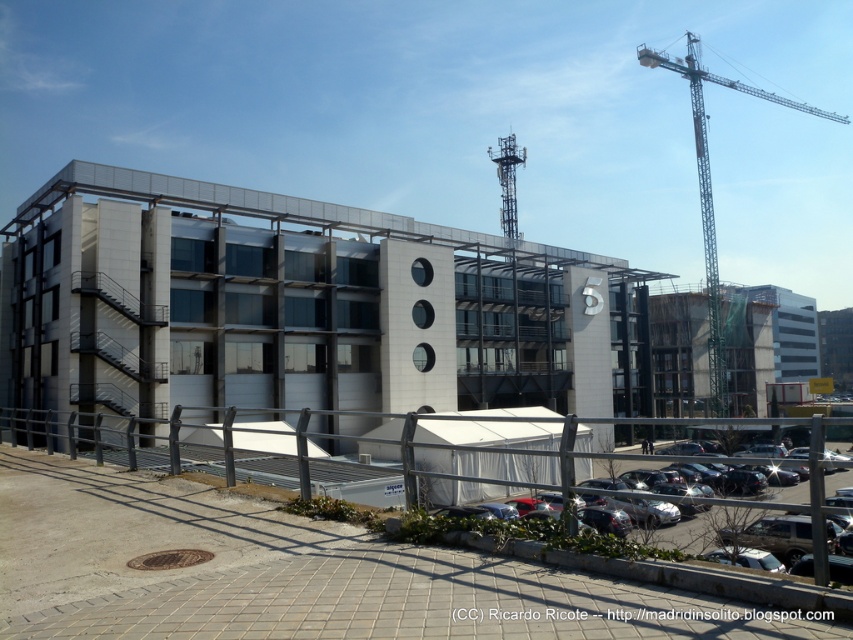
You are a delivery driver approaching the construction site. You need to park your vehicle in the black asphalt parking lot at lower right. However, there is a white tent at center blocking your path. Based on the scene, can you drive around the tent to reach the parking lot?

The white tent at center is to the left of black asphalt parking lot at lower right, so you can drive around the tent on its right side to reach the parking lot.

You are a construction worker standing at the edge of the paved area near the metal railing. You need to lift a heavy beam using the green metallic crane at upper right. However, there is a white tent at center in the way. Can the crane reach over the tent to lift the beam without moving the tent?

The white tent at center is shorter than the green metallic crane at upper right, so the crane can likely reach over the tent to lift the beam without needing to move it.

You are standing at the metal railing in the foreground of the scene. You notice two points marked on the building facade. The first point is at coordinate point (714, 236) and the second is at point (757, 500). From your current position, which point appears closer to you?

Point (757, 500) appears closer because it is in front of point (714, 236) according to their spatial arrangement.